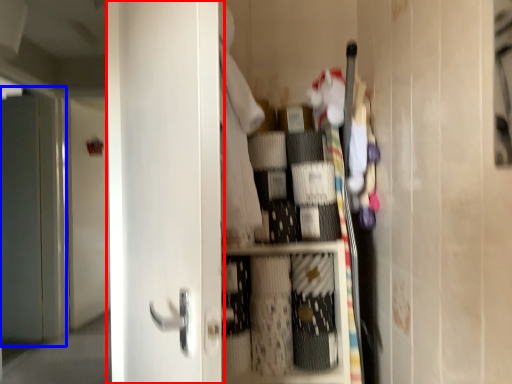
Question: Which object appears farthest to the camera in this image, door (highlighted by a red box) or screen door (highlighted by a blue box)?

Choices:
 (A) door
 (B) screen door

Answer: (B)